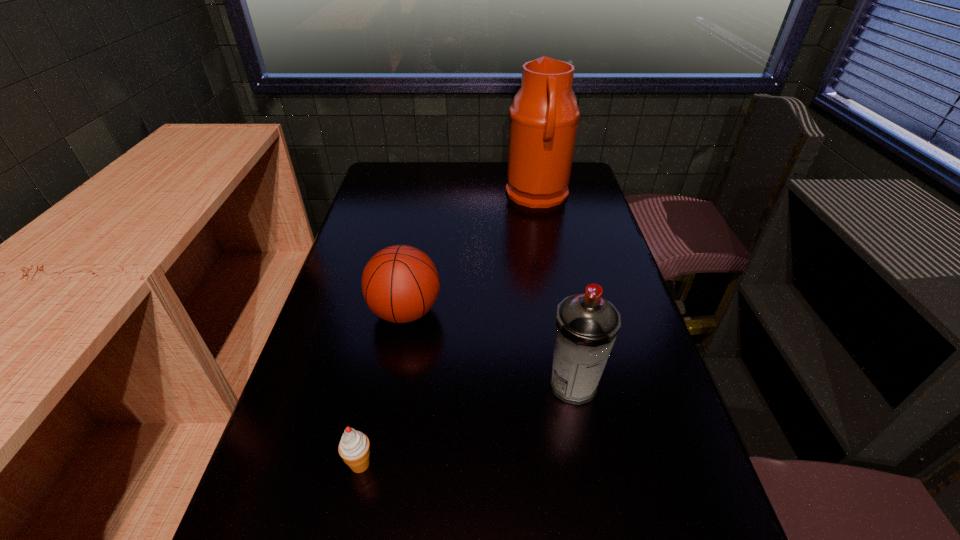
The width and height of the screenshot is (960, 540). In order to click on free space at the left edge in this screenshot , I will do `click(331, 366)`.

At what (x,y) coordinates should I click in order to perform the action: click on vacant area at the right edge of the desktop. Please return your answer as a coordinate pair (x, y). This screenshot has width=960, height=540. Looking at the image, I should click on [x=564, y=238].

Find the location of `vacant point located between the shortest object and the farthest object`. vacant point located between the shortest object and the farthest object is located at coordinates (449, 329).

Locate an element on the screen. This screenshot has height=540, width=960. empty space between the shortest object and the aerosol can is located at coordinates (467, 424).

I want to click on vacant space that is in between the water jug and the nearest object, so click(449, 329).

Identify the location of blank region between the water jug and the icecream. This screenshot has width=960, height=540. (449, 329).

In order to click on vacant area that lies between the basketball and the nearest object in this screenshot , I will do `click(383, 388)`.

Image resolution: width=960 pixels, height=540 pixels. Identify the location of vacant region between the third nearest object and the aerosol can. (490, 348).

Where is `free spot between the basketball and the aerosol can`? free spot between the basketball and the aerosol can is located at coordinates (490, 348).

Image resolution: width=960 pixels, height=540 pixels. Find the location of `empty location between the farthest object and the aerosol can`. empty location between the farthest object and the aerosol can is located at coordinates (555, 290).